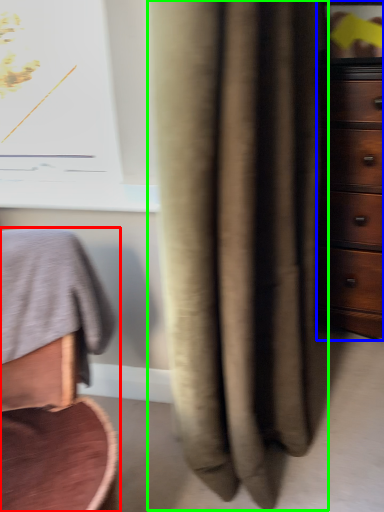
Question: Estimate the real-world distances between objects in this image. Which object is closer to furniture (highlighted by a red box), chest of drawers (highlighted by a blue box) or curtain (highlighted by a green box)?

Choices:
 (A) chest of drawers
 (B) curtain

Answer: (B)